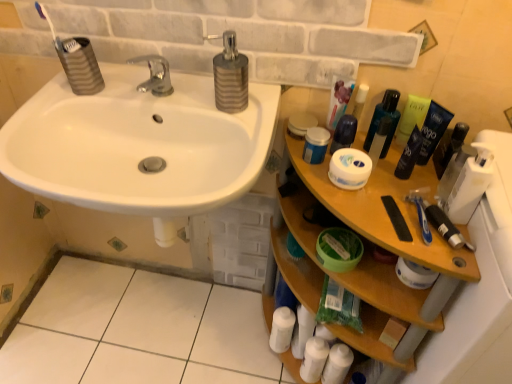
Find the location of a particular element. The height and width of the screenshot is (384, 512). space that is in front of white matte tube at upper right is located at coordinates (366, 200).